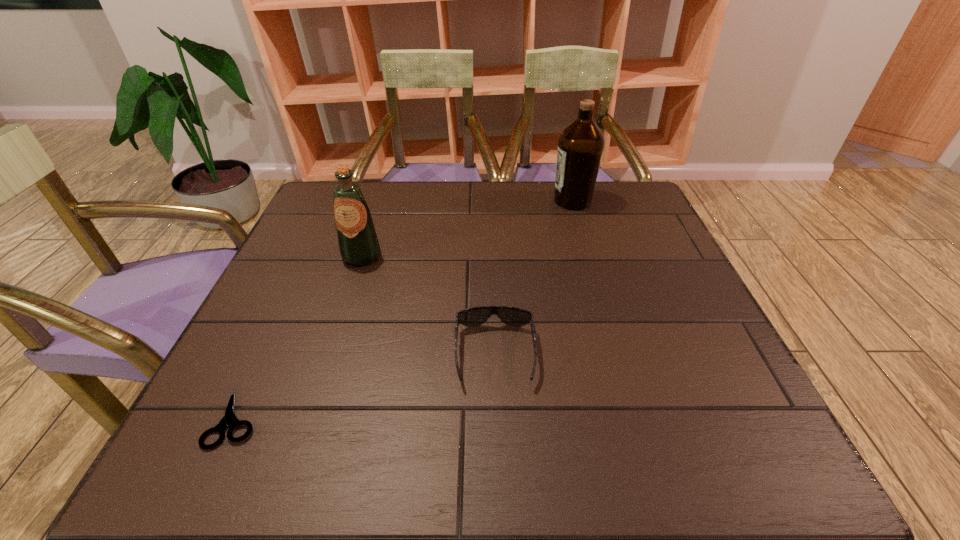
Where is `the tallest object`? The width and height of the screenshot is (960, 540). the tallest object is located at coordinates (581, 144).

In order to click on the rightmost object in this screenshot , I will do `click(581, 144)`.

In order to click on the shorter olive oil in this screenshot , I will do `click(357, 239)`.

Where is `the third object from right to left`? This screenshot has height=540, width=960. the third object from right to left is located at coordinates (357, 239).

Locate an element on the screen. the second object from right to left is located at coordinates (513, 316).

The image size is (960, 540). What are the coordinates of `the second shortest object` in the screenshot? It's located at (513, 316).

The height and width of the screenshot is (540, 960). Identify the location of shears. (229, 420).

Locate an element on the screen. The width and height of the screenshot is (960, 540). the shortest object is located at coordinates (229, 420).

What are the coordinates of `vacant space situated 0.050m on the label of the tallest object` in the screenshot? It's located at (535, 201).

Identify the location of vacant space situated 0.170m on the label of the tallest object. (x=493, y=201).